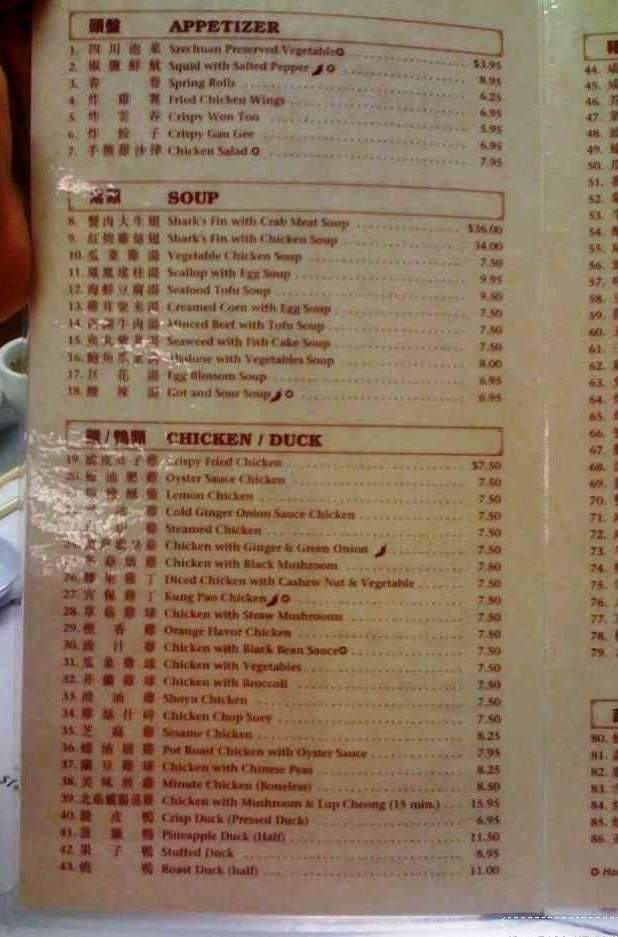
You are a GUI agent. You are given a task and a screenshot of the screen. Output one action in this format:
    pyautogui.click(x=<x>, y=<y>)
    Task: Click on the teacup in background
    
    Given the screenshot: What is the action you would take?
    pyautogui.click(x=15, y=357)